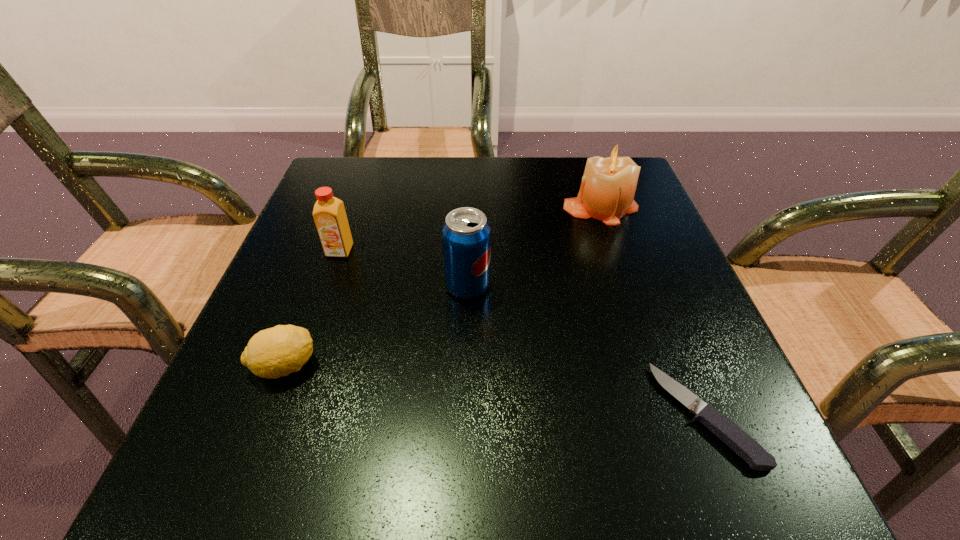
The width and height of the screenshot is (960, 540). I want to click on candle, so click(x=608, y=186).

I want to click on the third object from right to left, so click(466, 234).

Locate an element on the screen. The height and width of the screenshot is (540, 960). the third farthest object is located at coordinates (466, 234).

I want to click on the fourth nearest object, so click(329, 214).

This screenshot has width=960, height=540. In order to click on the fourth tallest object in this screenshot , I will do `click(278, 351)`.

You are a GUI agent. You are given a task and a screenshot of the screen. Output one action in this format:
    pyautogui.click(x=<x>, y=<y>)
    Task: Click on the shortest object
    The image size is (960, 540).
    Given the screenshot: What is the action you would take?
    pyautogui.click(x=726, y=430)

You are a GUI agent. You are given a task and a screenshot of the screen. Output one action in this format:
    pyautogui.click(x=<x>, y=<y>)
    Task: Click on the vacant space located on the front of the farthest object
    This screenshot has height=540, width=960.
    Given the screenshot: What is the action you would take?
    pyautogui.click(x=659, y=380)

Identify the location of free space located 0.130m on the right of the third object from left to right. (563, 286).

At what (x,y) coordinates should I click in order to perform the action: click on vacant space located on the front and back of the fourth nearest object. Please return your answer as a coordinate pair (x, y). Looking at the image, I should click on (269, 455).

I want to click on vacant space situated at the stem end of the lemon, so click(x=517, y=366).